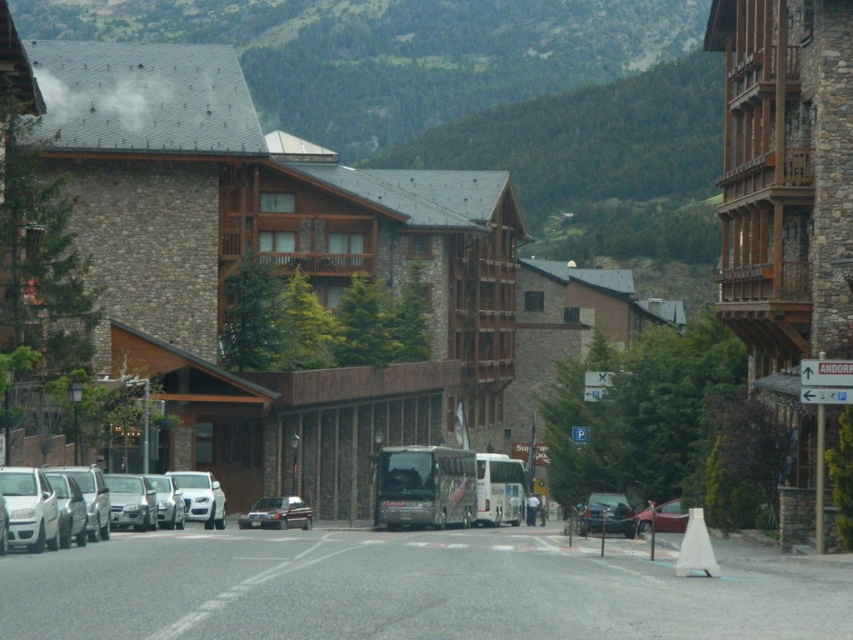
Question: Which object is the closest to the silver metallic sedan at center?

Choices:
 (A) white matte car at left
 (B) metallic silver sedan at center

Answer: (B)

Question: Considering the relative positions of green grassy mountain at upper center and metallic blue sedan at center in the image provided, where is green grassy mountain at upper center located with respect to metallic blue sedan at center?

Choices:
 (A) above
 (B) below

Answer: (A)

Question: Can you confirm if metallic blue sedan at center is positioned below silver metallic sedan at center?

Choices:
 (A) yes
 (B) no

Answer: (B)

Question: Is green grassy mountain at upper center below silver metallic sedan at center?

Choices:
 (A) yes
 (B) no

Answer: (B)

Question: Based on their relative distances, which object is farther from the green grassy mountain at upper center?

Choices:
 (A) metallic blue sedan at center
 (B) metallic silver sedan at center
 (C) white matte car at left
 (D) silver metallic sedan at center

Answer: (C)

Question: Which object appears farthest from the camera in this image?

Choices:
 (A) metallic blue sedan at center
 (B) silver metallic sedan at center
 (C) metallic silver sedan at center
 (D) white matte car at left

Answer: (B)